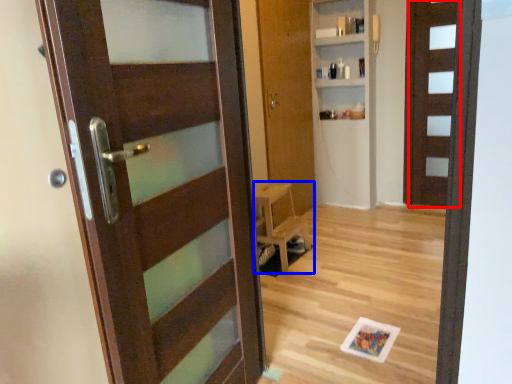
Question: Which object appears farthest to the camera in this image, door (highlighted by a red box) or furniture (highlighted by a blue box)?

Choices:
 (A) door
 (B) furniture

Answer: (A)